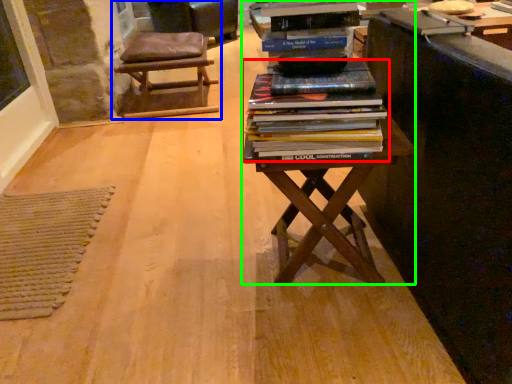
Question: Based on their relative distances, which object is farther from book (highlighted by a red box)? Choose from chair (highlighted by a blue box) and table (highlighted by a green box).

Choices:
 (A) chair
 (B) table

Answer: (A)